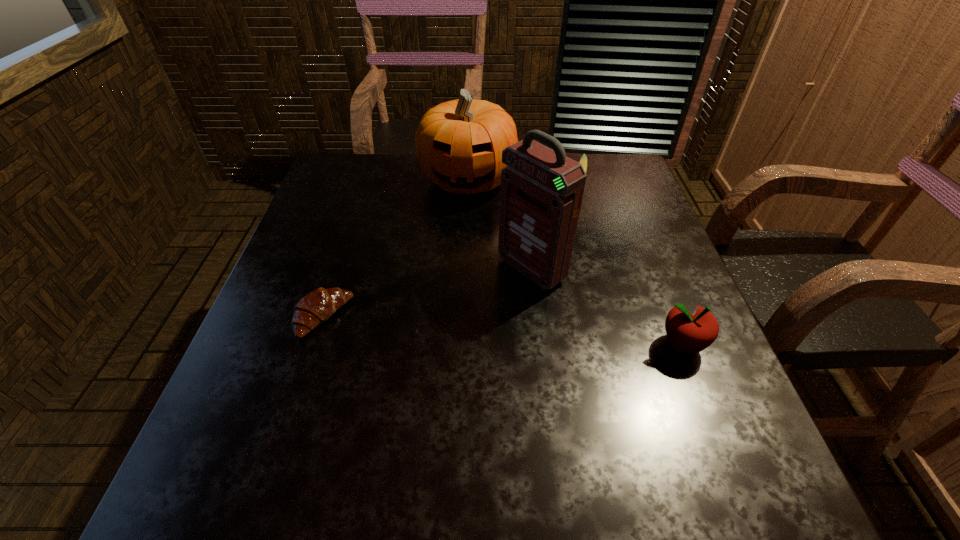
The image size is (960, 540). I want to click on crescent roll, so click(317, 306).

The height and width of the screenshot is (540, 960). I want to click on the leftmost object, so click(x=317, y=306).

Where is `the rightmost object`? The height and width of the screenshot is (540, 960). the rightmost object is located at coordinates (692, 333).

At what (x,y) coordinates should I click in order to perform the action: click on apple. Please return your answer as a coordinate pair (x, y). Image resolution: width=960 pixels, height=540 pixels. Looking at the image, I should click on (692, 333).

Locate an element on the screen. This screenshot has height=540, width=960. the second tallest object is located at coordinates (459, 143).

At what (x,y) coordinates should I click in order to perform the action: click on the second object from right to left. Please return your answer as a coordinate pair (x, y). Looking at the image, I should click on (583, 160).

I want to click on the second shortest object, so click(583, 160).

Locate an element on the screen. This screenshot has height=540, width=960. the tallest object is located at coordinates [x=541, y=193].

I want to click on the first-aid kit, so click(541, 193).

The image size is (960, 540). I want to click on vacant space located on the right of the crescent roll, so 428,318.